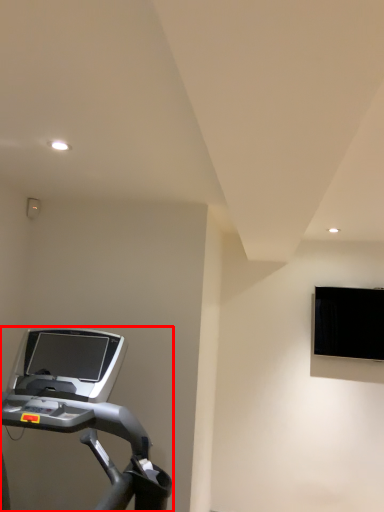
Question: Considering the relative positions of treadmill (annotated by the red box) and computer monitor in the image provided, where is treadmill (annotated by the red box) located with respect to the staircase?

Choices:
 (A) left
 (B) right

Answer: (A)